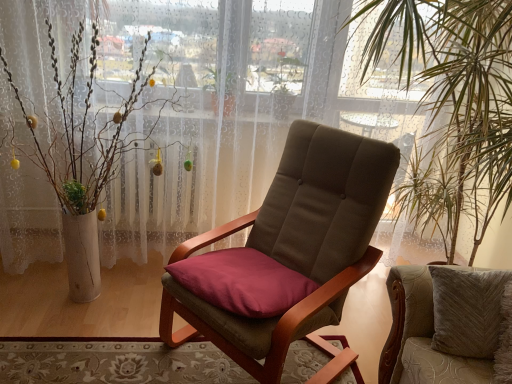
Image resolution: width=512 pixels, height=384 pixels. I want to click on empty space that is ontop of carpeted rug at lower left, so click(141, 357).